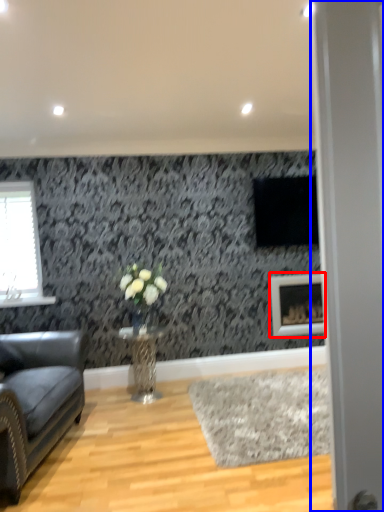
Question: Which point is further to the camera, picture frame (highlighted by a red box) or glass door (highlighted by a blue box)?

Choices:
 (A) picture frame
 (B) glass door

Answer: (A)